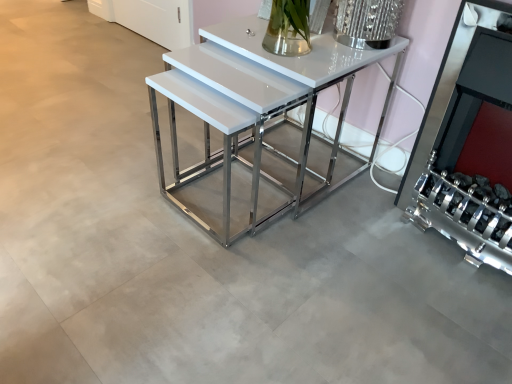
What are the coordinates of `vacant space positioned to the left of silver metallic fireplace at right` in the screenshot? It's located at (357, 238).